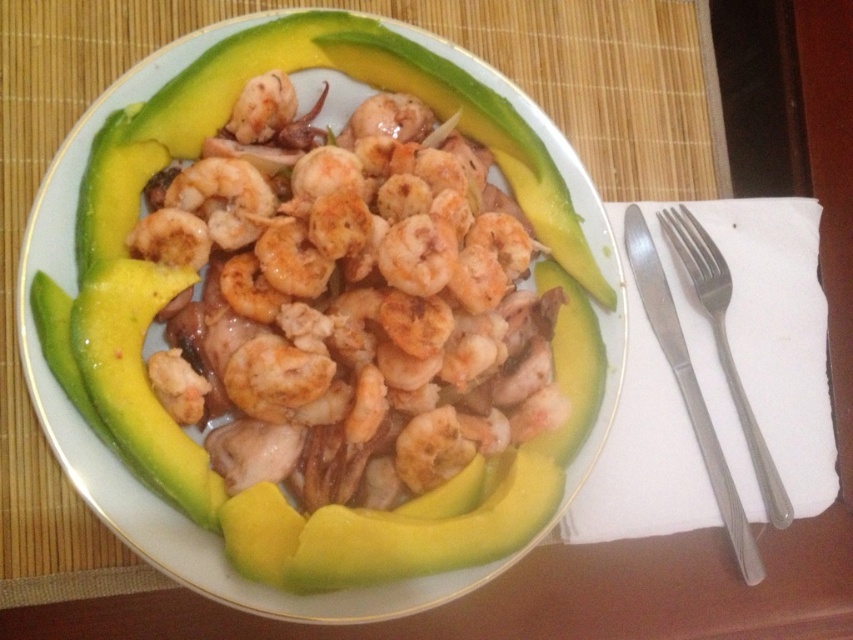
Question: Is shiny white plate at center to the right of satin silver fork at upper right from the viewer's perspective?

Choices:
 (A) no
 (B) yes

Answer: (A)

Question: Does shiny white plate at center appear over satin silver fork at upper right?

Choices:
 (A) yes
 (B) no

Answer: (A)

Question: Is shiny white plate at center positioned behind satin silver fork at upper right?

Choices:
 (A) yes
 (B) no

Answer: (B)

Question: Which object appears closest to the camera in this image?

Choices:
 (A) satin silver fork at upper right
 (B) shiny white plate at center

Answer: (B)